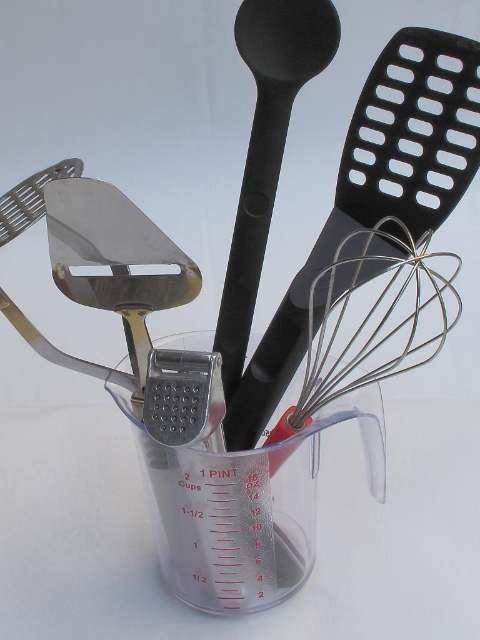
Question: Does black plastic spatula at upper right have a greater width compared to silver wire whisk at center?

Choices:
 (A) no
 (B) yes

Answer: (A)

Question: Which point is closer to the camera taking this photo?

Choices:
 (A) (410, 76)
 (B) (307, 36)

Answer: (A)

Question: Observing the image, what is the correct spatial positioning of black plastic spatula at upper right in reference to black matte spoon at center?

Choices:
 (A) right
 (B) left

Answer: (A)

Question: Which object appears closest to the camera in this image?

Choices:
 (A) black plastic spatula at upper right
 (B) black matte spoon at center
 (C) silver wire whisk at center

Answer: (C)

Question: Is black plastic spatula at upper right to the left of black matte spoon at center from the viewer's perspective?

Choices:
 (A) no
 (B) yes

Answer: (A)

Question: Which object is farther from the camera taking this photo?

Choices:
 (A) black plastic spatula at upper right
 (B) black matte spoon at center
 (C) silver wire whisk at center

Answer: (B)